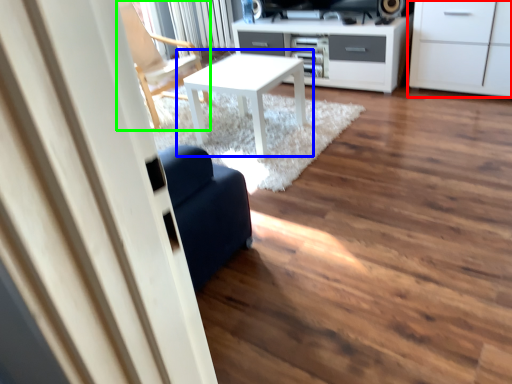
Question: Based on their relative distances, which object is farther from cabinetry (highlighted by a red box)? Choose from table (highlighted by a blue box) and chair (highlighted by a green box).

Choices:
 (A) table
 (B) chair

Answer: (B)